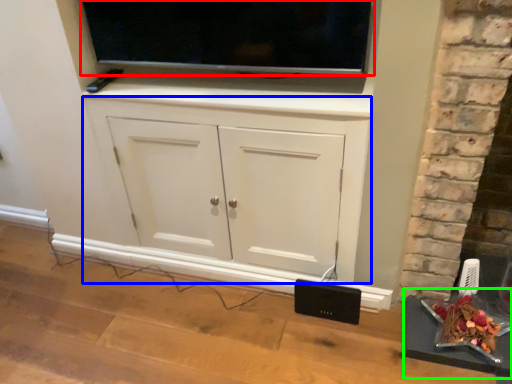
Question: Considering the real-world distances, which object is closest to television (highlighted by a red box)? cabinetry (highlighted by a blue box) or table (highlighted by a green box).

Choices:
 (A) cabinetry
 (B) table

Answer: (A)